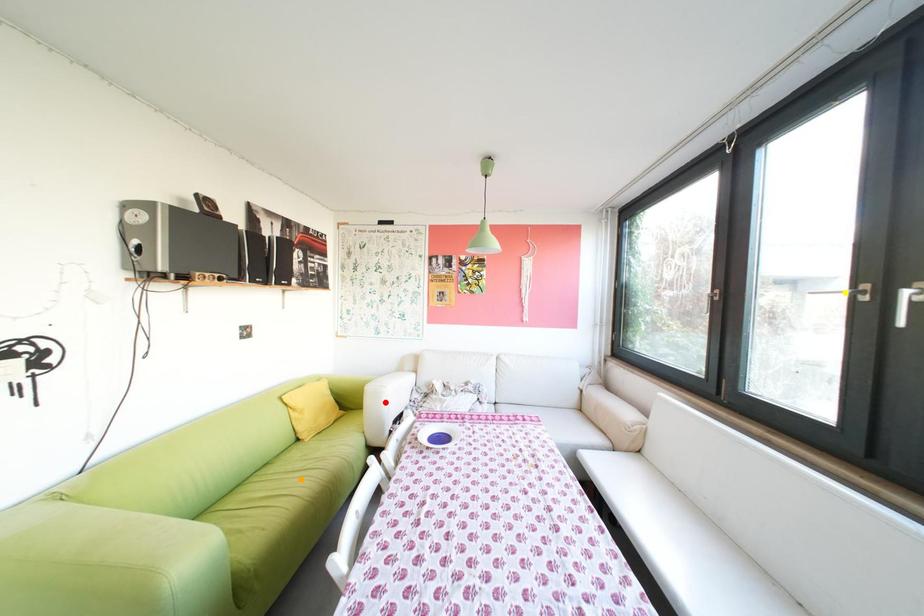
Order these from nearest to farthest:
A) orange point
B) red point
C) yellow point

yellow point
orange point
red point